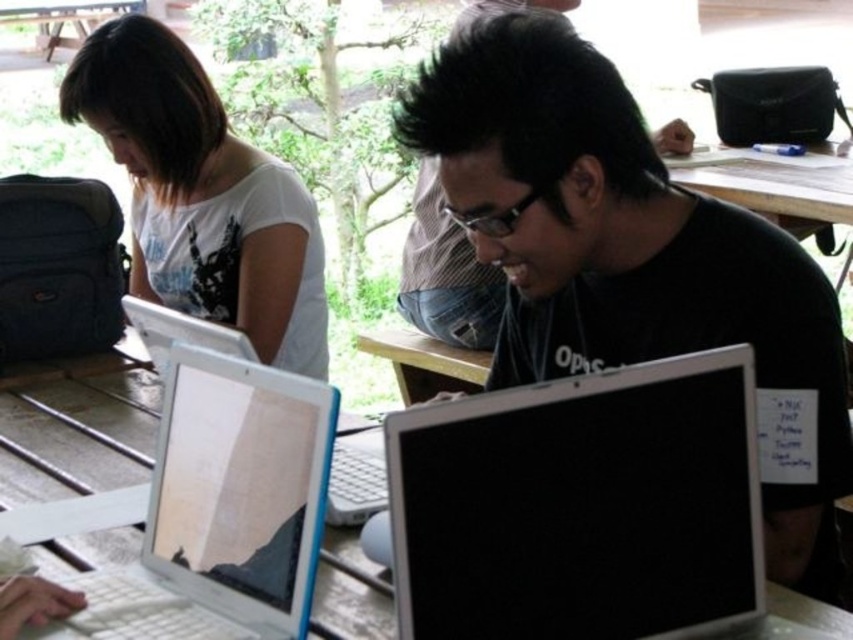
Question: Which object is the farthest from the black glossy laptop at center?

Choices:
 (A) white matte shirt at upper left
 (B) silver plastic laptop at left
 (C) black matte laptop at center
 (D) white plastic laptop at center

Answer: (A)

Question: Is silver plastic laptop at left positioned at the back of white matte shirt at upper left?

Choices:
 (A) no
 (B) yes

Answer: (A)

Question: Is black glossy laptop at center closer to camera compared to wooden picnic table at upper left?

Choices:
 (A) no
 (B) yes

Answer: (B)

Question: Which of these objects is positioned closest to the black glossy laptop at center?

Choices:
 (A) black matte laptop at center
 (B) white matte shirt at upper left
 (C) white plastic laptop at center

Answer: (A)

Question: Which of the following is the farthest from the observer?

Choices:
 (A) (360, 512)
 (B) (135, 42)

Answer: (B)

Question: Does white plastic laptop at center have a larger size compared to wooden picnic table at upper left?

Choices:
 (A) yes
 (B) no

Answer: (B)